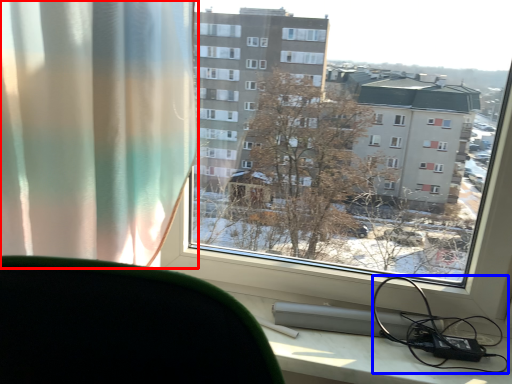
Question: Which object is closer to the camera taking this photo, curtain (highlighted by a red box) or cable (highlighted by a blue box)?

Choices:
 (A) curtain
 (B) cable

Answer: (A)